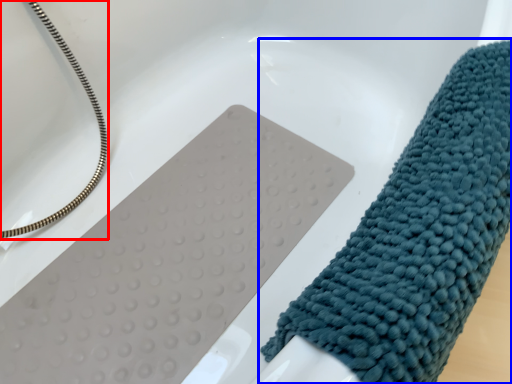
Question: Which object appears farthest to the camera in this image, rope (highlighted by a red box) or towel (highlighted by a blue box)?

Choices:
 (A) rope
 (B) towel

Answer: (A)